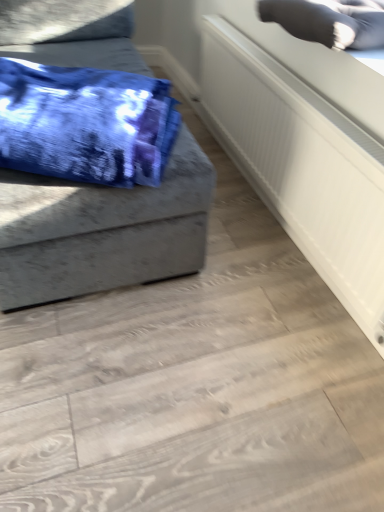
The image size is (384, 512). Describe the element at coordinates (85, 123) in the screenshot. I see `blue tie-dye fabric at left` at that location.

This screenshot has height=512, width=384. In order to click on blue tie-dye fabric at left in this screenshot , I will do `click(85, 123)`.

Describe the element at coordinates (329, 21) in the screenshot. I see `gray fabric pillow at upper right` at that location.

Where is `blue tie-dye fabric at left`? This screenshot has height=512, width=384. blue tie-dye fabric at left is located at coordinates (85, 123).

Is gray fabric pillow at upper right at the right side of blue tie-dye fabric at left?

Indeed, gray fabric pillow at upper right is positioned on the right side of blue tie-dye fabric at left.

How distant is gray fabric pillow at upper right from blue tie-dye fabric at left?

gray fabric pillow at upper right is 23.97 inches away from blue tie-dye fabric at left.

Is gray fabric pillow at upper right next to blue tie-dye fabric at left?

gray fabric pillow at upper right and blue tie-dye fabric at left are clearly separated.

Is gray fabric pillow at upper right completely or partially outside of blue tie-dye fabric at left?

Yes, gray fabric pillow at upper right is not within blue tie-dye fabric at left.

Where is `pillow in front of the white textured radiator at upper right`? pillow in front of the white textured radiator at upper right is located at coordinates (329, 21).

From the image's perspective, is gray fabric pillow at upper right above white textured radiator at upper right?

Yes, from the image's perspective, gray fabric pillow at upper right is above white textured radiator at upper right.

Is gray fabric pillow at upper right looking in the opposite direction of white textured radiator at upper right?

No, white textured radiator at upper right is not at the back of gray fabric pillow at upper right.

In terms of size, does gray fabric pillow at upper right appear bigger or smaller than white textured radiator at upper right?

gray fabric pillow at upper right is bigger than white textured radiator at upper right.

Is point (262, 194) positioned before point (372, 32)?

That is False.

The image size is (384, 512). Find the location of `pillow on the right of white textured radiator at upper right`. pillow on the right of white textured radiator at upper right is located at coordinates click(329, 21).

From the image's perspective, is white textured radiator at upper right beneath gray fabric pillow at upper right?

Yes, from the image's perspective, white textured radiator at upper right is beneath gray fabric pillow at upper right.

Which of these two, white textured radiator at upper right or gray fabric pillow at upper right, is smaller?

white textured radiator at upper right is smaller.

Does blue tie-dye fabric at left have a smaller size compared to white textured radiator at upper right?

No.

From a real-world perspective, is blue tie-dye fabric at left physically below white textured radiator at upper right?

Incorrect, from a real-world perspective, blue tie-dye fabric at left is higher than white textured radiator at upper right.

Considering the positions of objects blue tie-dye fabric at left and white textured radiator at upper right in the image provided, who is in front, blue tie-dye fabric at left or white textured radiator at upper right?

blue tie-dye fabric at left is in front.

From a real-world perspective, does white textured radiator at upper right sit lower than blue tie-dye fabric at left?

Yes, from a real-world perspective, white textured radiator at upper right is under blue tie-dye fabric at left.

Which object is further away from the camera, white textured radiator at upper right or blue tie-dye fabric at left?

white textured radiator at upper right is further from the camera.

How different are the orientations of white textured radiator at upper right and blue tie-dye fabric at left in degrees?

The facing directions of white textured radiator at upper right and blue tie-dye fabric at left are 64.6 degrees apart.

Is gray fabric pillow at upper right a part of blue tie-dye fabric at left?

No, blue tie-dye fabric at left does not contain gray fabric pillow at upper right.

From a real-world perspective, is blue tie-dye fabric at left over gray fabric pillow at upper right?

No, from a real-world perspective, blue tie-dye fabric at left is not above gray fabric pillow at upper right.

Where is `blanket below the gray fabric pillow at upper right (from the image's perspective)`? Image resolution: width=384 pixels, height=512 pixels. blanket below the gray fabric pillow at upper right (from the image's perspective) is located at coordinates (85, 123).

Between blue tie-dye fabric at left and gray fabric pillow at upper right, which one is positioned behind?

gray fabric pillow at upper right.

This screenshot has height=512, width=384. I want to click on pillow above the blue tie-dye fabric at left (from a real-world perspective), so click(x=329, y=21).

I want to click on pillow in front of the white textured radiator at upper right, so click(329, 21).

Considering their positions, is blue tie-dye fabric at left positioned closer to gray fabric pillow at upper right than white textured radiator at upper right?

The object closer to gray fabric pillow at upper right is white textured radiator at upper right.

Which object lies nearer to the anchor point white textured radiator at upper right, gray fabric pillow at upper right or blue tie-dye fabric at left?

gray fabric pillow at upper right.

Looking at the image, which one is located closer to blue tie-dye fabric at left, white textured radiator at upper right or gray fabric pillow at upper right?

white textured radiator at upper right is closer to blue tie-dye fabric at left.

Looking at the image, which one is located further to white textured radiator at upper right, blue tie-dye fabric at left or gray fabric pillow at upper right?

blue tie-dye fabric at left is positioned further to the anchor white textured radiator at upper right.

Looking at the image, which one is located closer to gray fabric pillow at upper right, white textured radiator at upper right or blue tie-dye fabric at left?

white textured radiator at upper right lies closer to gray fabric pillow at upper right than the other object.

From the image, which object appears to be farther from blue tie-dye fabric at left, gray fabric pillow at upper right or white textured radiator at upper right?

gray fabric pillow at upper right is positioned further to the anchor blue tie-dye fabric at left.

You are a GUI agent. You are given a task and a screenshot of the screen. Output one action in this format:
    pyautogui.click(x=<x>, y=<y>)
    Task: Click on the radiator located between blue tie-dye fabric at left and gray fabric pillow at upper right in the left-right direction
    Image resolution: width=384 pixels, height=512 pixels.
    Given the screenshot: What is the action you would take?
    pyautogui.click(x=302, y=166)